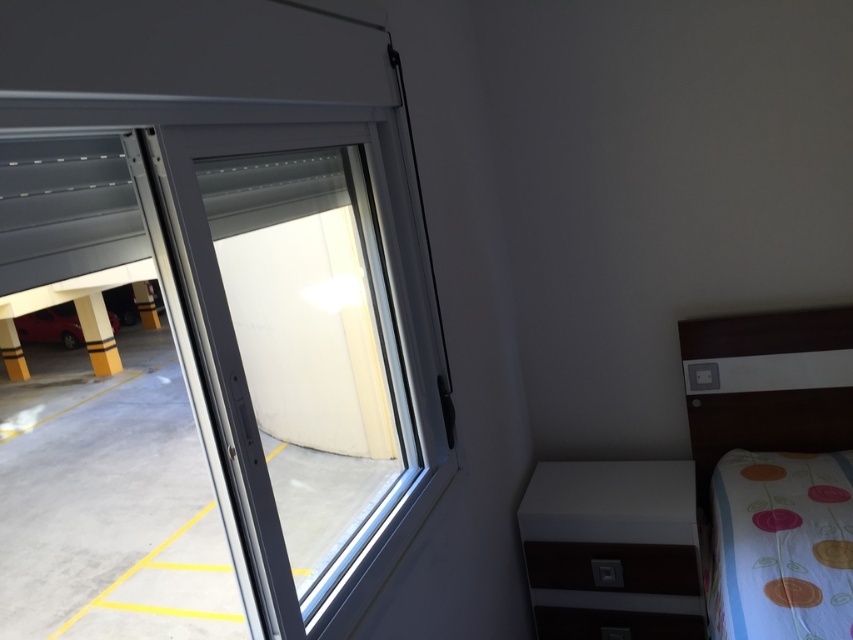
You are standing in the bedroom and want to place a small plant pot between the white glossy cabinet at lower right and the shiny red car at lower left. Based on their positions, can you tell me which object is closer to you so the plant pot can be placed in between them?

The white glossy cabinet at lower right is in front of the shiny red car at lower left, so the plant pot should be placed between them with the white glossy cabinet at lower right closer to you.